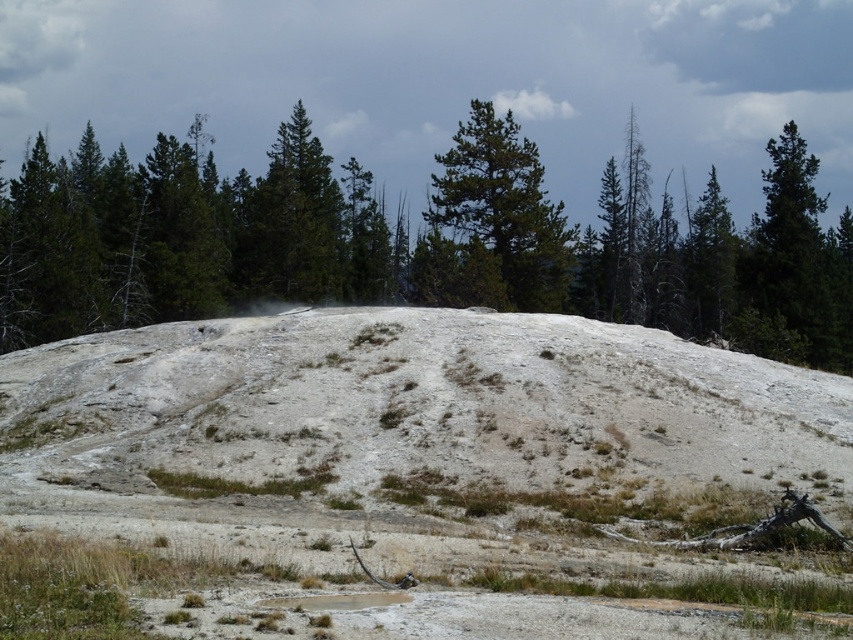
You are an environmental scientist studying the vegetation in this landscape. You observe the green textured tree at center and the green matte tree at center. Which tree would you expect to cast a larger shadow during midday? Explain your reasoning based on their descriptions.

The green textured tree at center is larger in size compared to the green matte tree at center. Since larger trees generally cast larger shadows, the green textured tree at center would cast a larger shadow during midday.

You are an environmental scientist studying the trees in the forest. You observe the green textured tree at center and the green matte tree at center. Which tree would cast a longer shadow during midday when the sun is directly overhead?

The green textured tree at center is much taller than the green matte tree at center, so it would cast a longer shadow during midday when the sun is directly overhead.